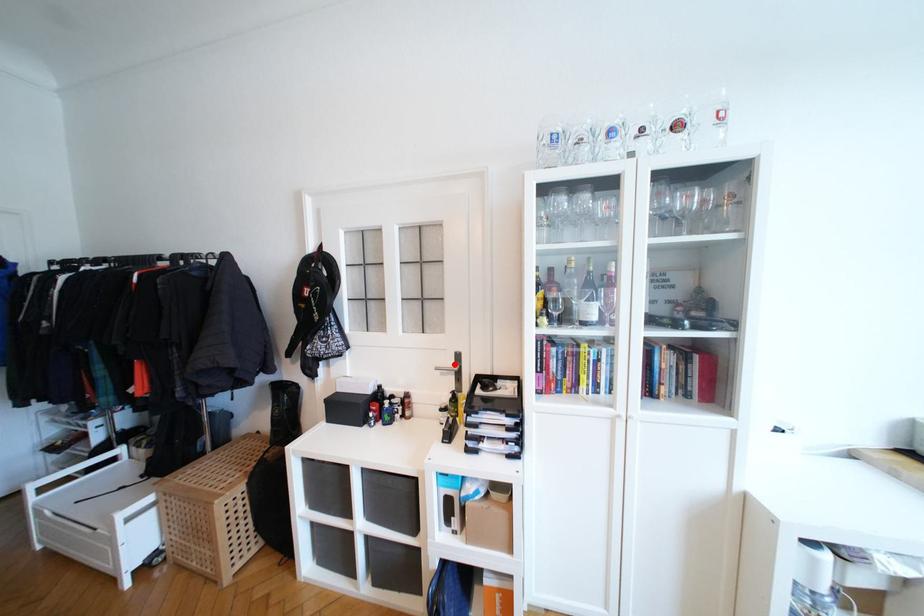
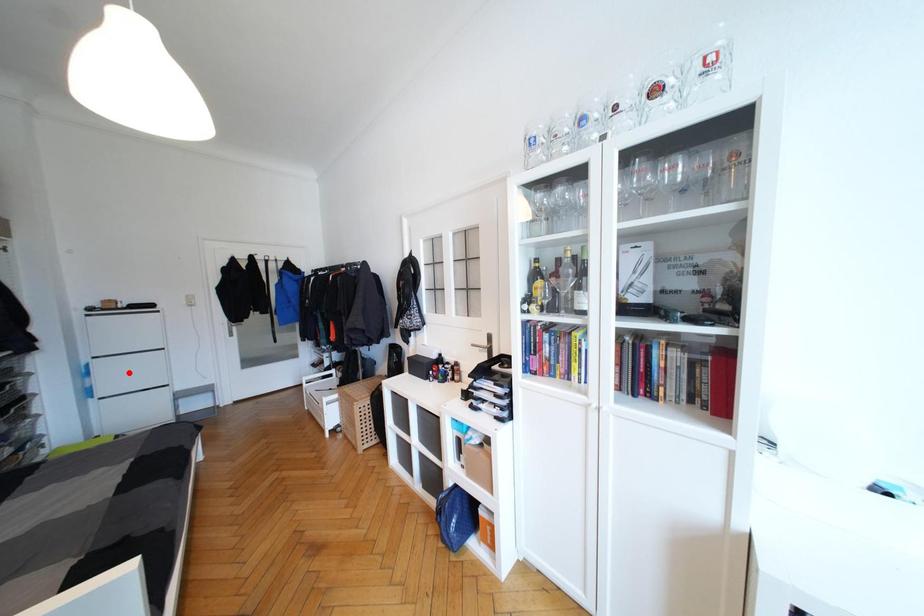
I am providing you with two images of the same scene from different viewpoints. A red point is marked on the first image and another point is marked on the second image. Does the point marked in image1 correspond to the same location as the one in image2?

No